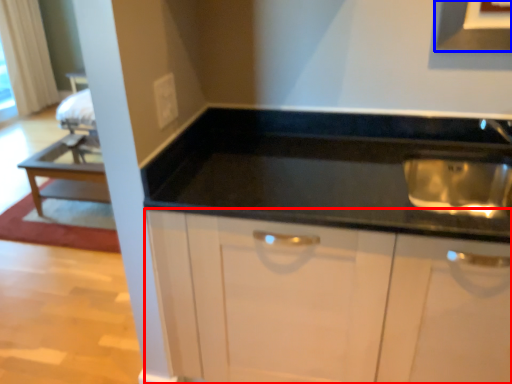
Question: Which point is closer to the camera, cabinetry (highlighted by a red box) or exhaust hood (highlighted by a blue box)?

Choices:
 (A) cabinetry
 (B) exhaust hood

Answer: (A)